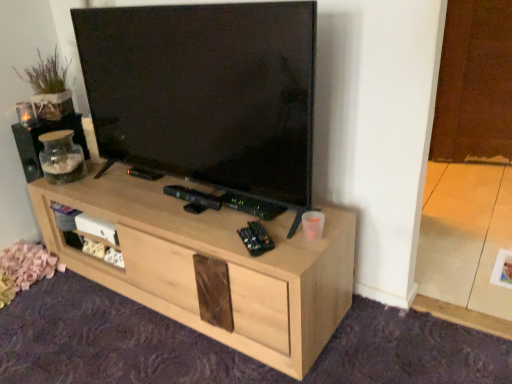
Question: Can you confirm if matte glass jar at left is taller than natural wood tv stand at center?

Choices:
 (A) no
 (B) yes

Answer: (A)

Question: Can you confirm if matte glass jar at left is smaller than natural wood tv stand at center?

Choices:
 (A) yes
 (B) no

Answer: (A)

Question: From the image's perspective, is matte glass jar at left located above natural wood tv stand at center?

Choices:
 (A) no
 (B) yes

Answer: (B)

Question: Is natural wood tv stand at center located within matte glass jar at left?

Choices:
 (A) no
 (B) yes

Answer: (A)

Question: Considering the relative positions of matte glass jar at left and natural wood tv stand at center in the image provided, is matte glass jar at left behind natural wood tv stand at center?

Choices:
 (A) no
 (B) yes

Answer: (B)

Question: Is natural wood tv stand at center at the back of matte glass jar at left?

Choices:
 (A) yes
 (B) no

Answer: (B)

Question: Can matte glass jar at left be found inside natural wood tv stand at center?

Choices:
 (A) yes
 (B) no

Answer: (B)

Question: From a real-world perspective, is natural wood tv stand at center physically below matte glass jar at left?

Choices:
 (A) no
 (B) yes

Answer: (B)

Question: Can you confirm if natural wood tv stand at center is positioned to the right of matte glass jar at left?

Choices:
 (A) no
 (B) yes

Answer: (B)

Question: Is natural wood tv stand at center not inside matte glass jar at left?

Choices:
 (A) no
 (B) yes

Answer: (B)

Question: From the image's perspective, would you say natural wood tv stand at center is shown under matte glass jar at left?

Choices:
 (A) no
 (B) yes

Answer: (B)

Question: From the image's perspective, is natural wood tv stand at center located above matte glass jar at left?

Choices:
 (A) no
 (B) yes

Answer: (A)

Question: Would you say matte glass jar at left is to the left or to the right of natural wood tv stand at center in the picture?

Choices:
 (A) right
 (B) left

Answer: (B)